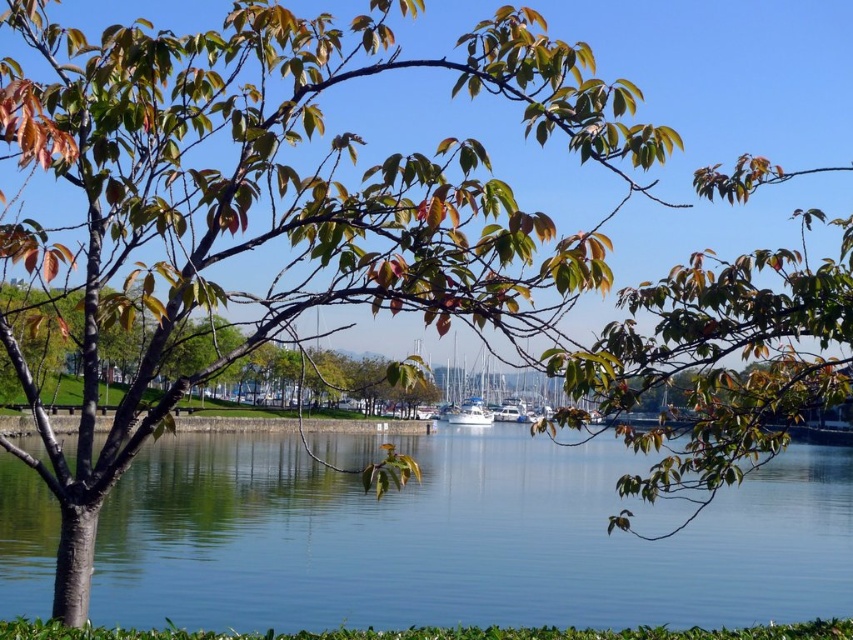
You are an observer standing at the lakeside looking towards the center of the lake. You notice the clear blue water at center and the white glossy boat at center. Which object appears taller from your vantage point?

The clear blue water at center appears taller than the white glossy boat at center from your vantage point because the clear blue water at center has a greater height compared to the white glossy boat at center.

Looking at this image, you are an observer standing at the lakeside. You notice the green matte tree at center and the white glossy boat at center. Which object appears bigger in the scene?

The green matte tree at center appears bigger than the white glossy boat at center in the scene.